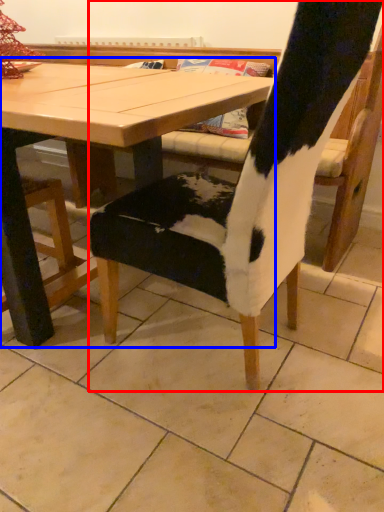
Question: Which of the following is the farthest to the observer, chair (highlighted by a red box) or table (highlighted by a blue box)?

Choices:
 (A) chair
 (B) table

Answer: (B)